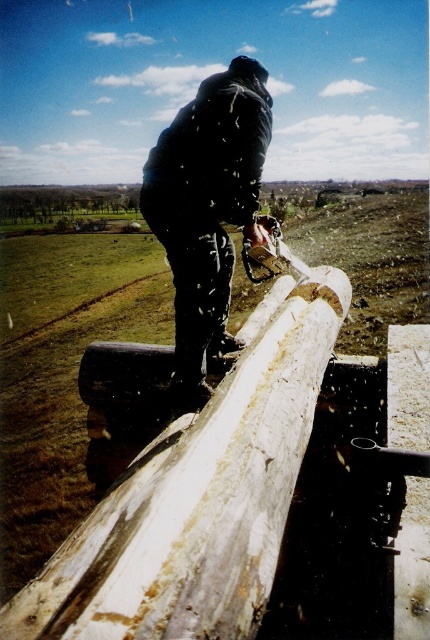
Does white wood beam at center appear on the right side of dark blue jacket at upper center?

Correct, you'll find white wood beam at center to the right of dark blue jacket at upper center.

Does white wood beam at center have a larger size compared to dark blue jacket at upper center?

No.

Between point (165, 624) and point (202, 266), which one is positioned behind?

The point (202, 266) is more distant.

Find the location of a particular element. The width and height of the screenshot is (430, 640). white wood beam at center is located at coordinates (199, 497).